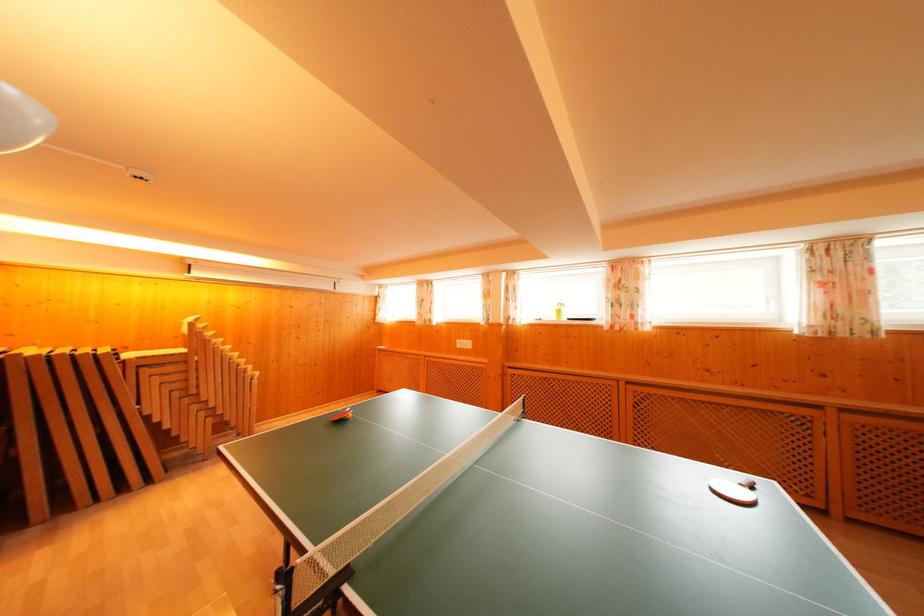
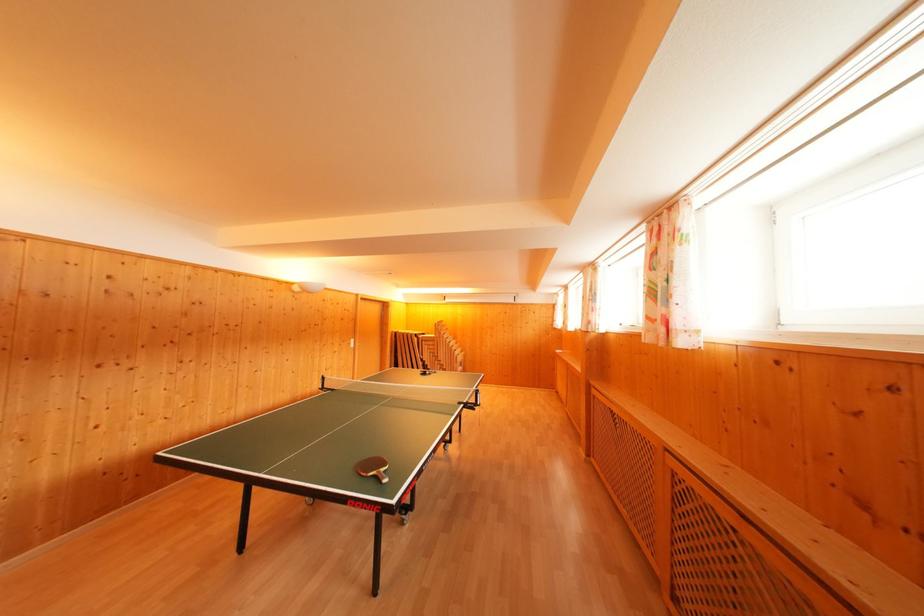
Where in the second image is the point corresponding to the point at 213,398 from the first image?

(445, 362)